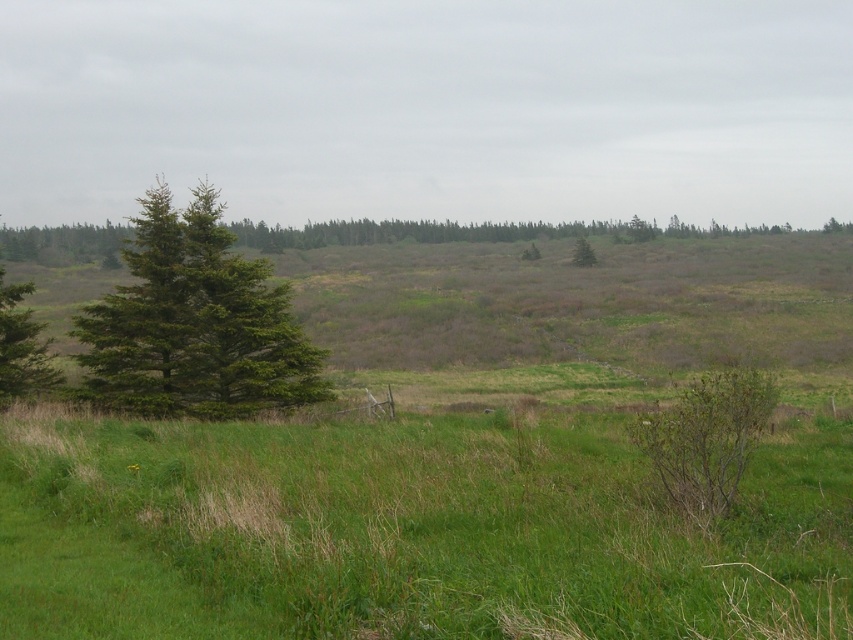
You are standing in the middle of the green field and see the green matte tree at left and the green matte tree at center. Which tree is closer to your right side?

The green matte tree at center is closer to your right side because it is positioned to the right of the green matte tree at left.

Based on the photo, you are standing at the center of the image and want to locate the green matte tree at left. Which direction should you look to find it?

The green matte tree at left is located at point coordinates of (195,323), so you should look to the left side of the image to find it.